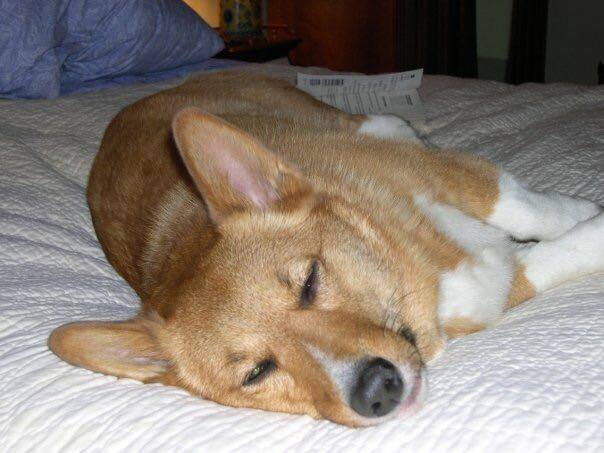
Locate an element on the screen. bed is located at coordinates (29, 240).